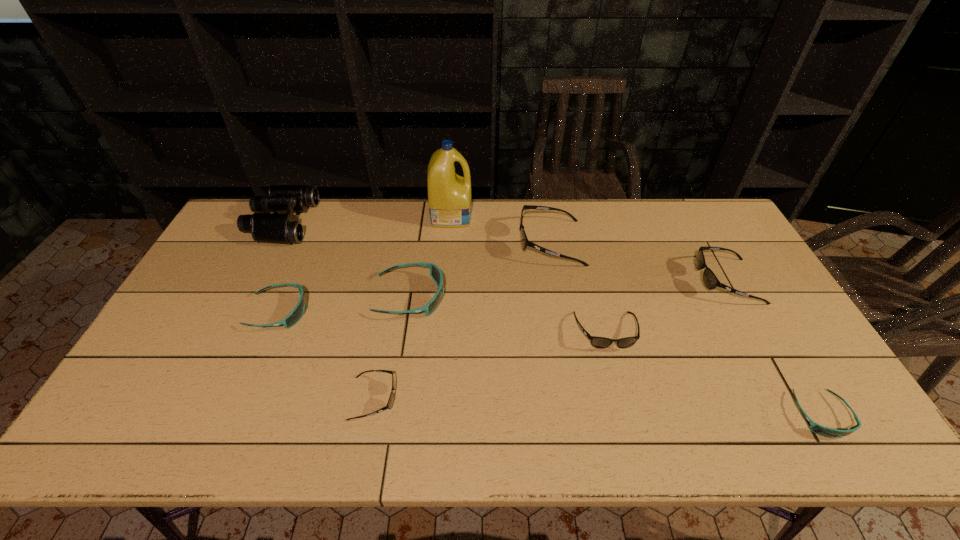
Select which sunglasses is the sixth closest to the biggest cyan sunglasses. Please provide its 2D coordinates. Your answer should be formatted as a tuple, i.e. [(x, y)], where the tuple contains the x and y coordinates of a point satisfying the conditions above.

[(827, 432)]

Point out which gray sunglasses is positioned as the second nearest to the nearest cyan sunglasses. Please provide its 2D coordinates. Your answer should be formatted as a tuple, i.e. [(x, y)], where the tuple contains the x and y coordinates of a point satisfying the conditions above.

[(598, 342)]

Identify which gray sunglasses is the nearest to the biggest cyan sunglasses. Please provide its 2D coordinates. Your answer should be formatted as a tuple, i.e. [(x, y)], where the tuple contains the x and y coordinates of a point satisfying the conditions above.

[(390, 402)]

Find the location of `cyan sunglasses identified as the third closest to the second biggest gray sunglasses`. cyan sunglasses identified as the third closest to the second biggest gray sunglasses is located at coordinates (296, 314).

This screenshot has height=540, width=960. I want to click on cyan sunglasses that is the closest to the rightmost cyan sunglasses, so click(x=435, y=272).

I want to click on free region that satisfies the following two spatial constraints: 1. on the front-facing side of the third smallest gray sunglasses; 2. on the front-facing side of the second nearest gray sunglasses, so click(x=755, y=332).